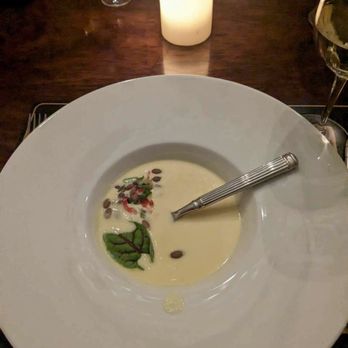
Locate an element on the screen. The image size is (348, 348). wooden table surface is located at coordinates (63, 33).